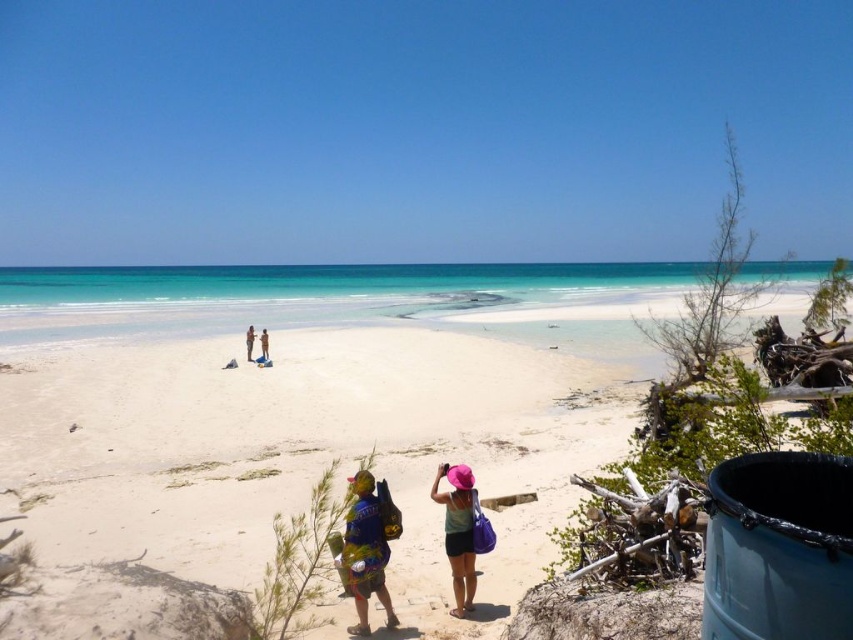
Who is positioned more to the left, pink fabric hat at center or light brown sand at center?

light brown sand at center

Locate an element on the screen. Image resolution: width=853 pixels, height=640 pixels. pink fabric hat at center is located at coordinates (457, 531).

Which is behind, point (372, 579) or point (248, 358)?

Positioned behind is point (248, 358).

Which is in front, point (358, 577) or point (248, 352)?

Point (358, 577) is more forward.

Image resolution: width=853 pixels, height=640 pixels. I want to click on multicolored fabric backpack at lower center, so click(x=364, y=552).

Identify the location of multicolored fabric backpack at lower center. (364, 552).

Can you confirm if multicolored fabric backpack at lower center is wider than light brown sand at center?

No, multicolored fabric backpack at lower center is not wider than light brown sand at center.

Does multicolored fabric backpack at lower center have a lesser height compared to light brown sand at center?

No.

Measure the distance between multicolored fabric backpack at lower center and camera.

5.34 meters

Locate an element on the screen. The height and width of the screenshot is (640, 853). multicolored fabric backpack at lower center is located at coordinates (364, 552).